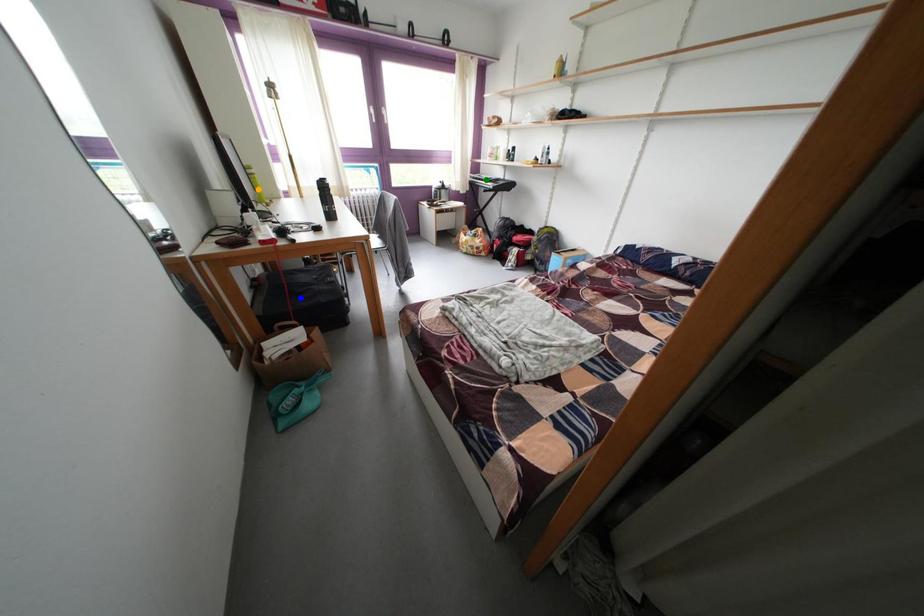
Order these from farthest to nearest:
- green point
- blue point
- orange point

green point, blue point, orange point